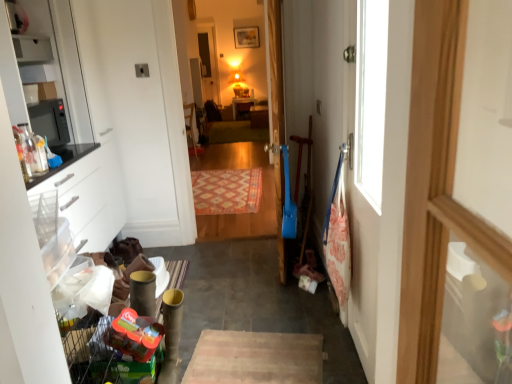
What do you see at coordinates (93, 199) in the screenshot? This screenshot has height=384, width=512. I see `white matte cabinet at left, marked as the 1th cabinetry in a bottom-to-top arrangement` at bounding box center [93, 199].

At what (x,y) coordinates should I click in order to perform the action: click on carpeted wooden floor at center. Please return your answer as a coordinate pair (x, y). The image size is (512, 384). Looking at the image, I should click on (221, 48).

The width and height of the screenshot is (512, 384). I want to click on blue plastic door at center, so click(276, 114).

The width and height of the screenshot is (512, 384). In order to click on wooden table at center in this screenshot , I will do `click(241, 102)`.

Describe the element at coordinates (227, 191) in the screenshot. I see `orange woven rug at center, the 1th mat when ordered from front to back` at that location.

What is the approximate width of wooden picture frame at upper center?

5.20 centimeters.

This screenshot has height=384, width=512. I want to click on matte white shelf at upper left, so (32, 49).

Locate an element on the screen. matte white cabinet at center, which appears as the 2th cabinetry when viewed from the front is located at coordinates (259, 116).

Is wooden picture frame at upper center thinner than carpeted wooden floor at center?

Indeed, wooden picture frame at upper center has a lesser width compared to carpeted wooden floor at center.

Is wooden picture frame at upper center not inside carpeted wooden floor at center?

Yes, wooden picture frame at upper center is not within carpeted wooden floor at center.

Considering the positions of objects wooden picture frame at upper center and carpeted wooden floor at center in the image provided, who is more to the right, wooden picture frame at upper center or carpeted wooden floor at center?

From the viewer's perspective, carpeted wooden floor at center appears more on the right side.

Is wooden picture frame at upper center next to carpeted wooden floor at center and touching it?

No, wooden picture frame at upper center is not in contact with carpeted wooden floor at center.

From a real-world perspective, who is located lower, translucent plastic toy at lower left or wooden table at center?

wooden table at center, from a real-world perspective.

Is translucent plastic toy at lower left aimed at wooden table at center?

No, translucent plastic toy at lower left is not facing towards wooden table at center.

Are translucent plastic toy at lower left and wooden table at center making contact?

They are not placed beside each other.

Looking at this image, which of these two, translucent plastic toy at lower left or carpeted wooden floor at center, stands shorter?

Standing shorter between the two is translucent plastic toy at lower left.

Considering the sizes of objects translucent plastic toy at lower left and carpeted wooden floor at center in the image provided, who is thinner, translucent plastic toy at lower left or carpeted wooden floor at center?

With smaller width is carpeted wooden floor at center.

Which is in front, point (135, 314) or point (203, 91)?

The point (135, 314) is in front.

Is point (239, 100) closer to viewer compared to point (214, 216)?

No, (239, 100) is further to viewer.

From the image's perspective, between wooden table at center and carpeted wooden floor at center, who is located below?

carpeted wooden floor at center.

Where is `table that is above the carpeted wooden floor at center (from the image's perspective)`? This screenshot has width=512, height=384. table that is above the carpeted wooden floor at center (from the image's perspective) is located at coordinates tap(241, 102).

Looking at this image, is wooden table at center bigger or smaller than carpeted wooden floor at center?

wooden table at center is smaller than carpeted wooden floor at center.

Can you confirm if orange woven rug at center, acting as the second mat starting from the back, is smaller than green carpet at center, which is the second mat from bottom to top?

Indeed, orange woven rug at center, acting as the second mat starting from the back, has a smaller size compared to green carpet at center, which is the second mat from bottom to top.

Is point (209, 206) positioned after point (240, 130)?

No, (209, 206) is in front of (240, 130).

Is orange woven rug at center, the 1th mat when ordered from front to back, oriented away from green carpet at center, the first mat from the back?

Yes, orange woven rug at center, the 1th mat when ordered from front to back,'s orientation is away from green carpet at center, the first mat from the back.

From the picture: Is orange woven rug at center, the 1th mat positioned from the bottom, to the left of green carpet at center, which is counted as the second mat, starting from the front, from the viewer's perspective?

Yes.

Is the position of wooden table at center less distant than that of matte white shelf at upper left?

No.

From a real-world perspective, is wooden table at center beneath matte white shelf at upper left?

Indeed, from a real-world perspective, wooden table at center is positioned beneath matte white shelf at upper left.

Would you say wooden table at center is to the left or to the right of matte white shelf at upper left in the picture?

wooden table at center is to the right of matte white shelf at upper left.

Is carpeted wooden floor at center not inside matte white cabinet at center, the second cabinetry from the left?

carpeted wooden floor at center is positioned outside matte white cabinet at center, the second cabinetry from the left.

Is carpeted wooden floor at center at the right side of matte white cabinet at center, the second cabinetry from the left?

Incorrect, carpeted wooden floor at center is not on the right side of matte white cabinet at center, the second cabinetry from the left.

Considering the positions of objects carpeted wooden floor at center and matte white cabinet at center, positioned as the first cabinetry in top-to-bottom order, in the image provided, who is behind, carpeted wooden floor at center or matte white cabinet at center, positioned as the first cabinetry in top-to-bottom order,?

matte white cabinet at center, positioned as the first cabinetry in top-to-bottom order, is behind.

The width and height of the screenshot is (512, 384). In order to click on picture frame located on the left of carpeted wooden floor at center in this screenshot , I will do point(246,37).

Where is `table lying on the right of translucent plastic toy at lower left`? This screenshot has width=512, height=384. table lying on the right of translucent plastic toy at lower left is located at coordinates (241, 102).

Which object lies nearer to the anchor point wooden table at center, wooden picture frame at upper center or green carpet at center, the first mat from the back?

green carpet at center, the first mat from the back, lies closer to wooden table at center than the other object.

Considering their positions, is orange woven rug at center, which is the 2th mat from top to bottom, positioned further to matte white cabinet at center, which appears as the 2th cabinetry when viewed from the front, than carpeted wooden floor at center?

Among the two, orange woven rug at center, which is the 2th mat from top to bottom, is located further to matte white cabinet at center, which appears as the 2th cabinetry when viewed from the front.

Based on their spatial positions, is white matte cabinet at left, which ranks as the second cabinetry in top-to-bottom order, or blue plastic door at center further from matte white cabinet at center, arranged as the 2th cabinetry when ordered from the bottom?

white matte cabinet at left, which ranks as the second cabinetry in top-to-bottom order.

Based on their spatial positions, is translucent plastic toy at lower left or matte white cabinet at center, marked as the first cabinetry in a back-to-front arrangement, further from matte white shelf at upper left?

matte white cabinet at center, marked as the first cabinetry in a back-to-front arrangement, is positioned further to the anchor matte white shelf at upper left.

From the image, which object appears to be nearer to matte white cabinet at center, positioned as the first cabinetry in top-to-bottom order, blue plastic door at center or wooden table at center?

Based on the image, wooden table at center appears to be nearer to matte white cabinet at center, positioned as the first cabinetry in top-to-bottom order.

Looking at the image, which one is located closer to orange woven rug at center, the 1th mat when ordered from front to back, green carpet at center, acting as the 1th mat starting from the top, or translucent plastic toy at lower left?

green carpet at center, acting as the 1th mat starting from the top, is positioned closer to the anchor orange woven rug at center, the 1th mat when ordered from front to back.

When comparing their distances from wooden table at center, does carpeted wooden floor at center or wooden picture frame at upper center seem further?

wooden picture frame at upper center is further to wooden table at center.

Estimate the real-world distances between objects in this image. Which object is further from matte white shelf at upper left, carpeted wooden floor at center or wooden table at center?

The object further to matte white shelf at upper left is wooden table at center.

Find the location of `corridor between matte white shelf at upper left and translucent plastic toy at lower left vertically`. corridor between matte white shelf at upper left and translucent plastic toy at lower left vertically is located at coordinates (221, 48).

This screenshot has width=512, height=384. I want to click on corridor situated between matte white shelf at upper left and blue plastic door at center from left to right, so [221, 48].

Image resolution: width=512 pixels, height=384 pixels. What are the coordinates of `mat located between orange woven rug at center, the 1th mat when ordered from front to back, and wooden picture frame at upper center in the depth direction` in the screenshot? It's located at (234, 132).

What are the coordinates of `corridor positioned between matte white shelf at upper left and matte white cabinet at center, arranged as the 2th cabinetry when ordered from the bottom, from near to far` in the screenshot? It's located at (221, 48).